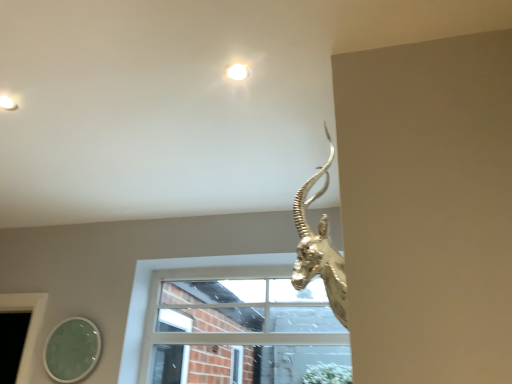
Question: From a real-world perspective, is green glass mirror at lower left positioned under gold metallic antelope head at upper right based on gravity?

Choices:
 (A) no
 (B) yes

Answer: (B)

Question: From the image's perspective, does green glass mirror at lower left appear lower than gold metallic antelope head at upper right?

Choices:
 (A) yes
 (B) no

Answer: (A)

Question: Does green glass mirror at lower left appear on the right side of gold metallic antelope head at upper right?

Choices:
 (A) yes
 (B) no

Answer: (B)

Question: Can gold metallic antelope head at upper right be found inside green glass mirror at lower left?

Choices:
 (A) yes
 (B) no

Answer: (B)

Question: Considering the relative sizes of green glass mirror at lower left and gold metallic antelope head at upper right in the image provided, is green glass mirror at lower left taller than gold metallic antelope head at upper right?

Choices:
 (A) no
 (B) yes

Answer: (A)

Question: Is green glass mirror at lower left outside gold metallic antelope head at upper right?

Choices:
 (A) no
 (B) yes

Answer: (B)

Question: Considering the relative sizes of green glass mirror at lower left and white glass window at center in the image provided, is green glass mirror at lower left wider than white glass window at center?

Choices:
 (A) yes
 (B) no

Answer: (B)

Question: Is green glass mirror at lower left with white glass window at center?

Choices:
 (A) yes
 (B) no

Answer: (B)

Question: Can you confirm if green glass mirror at lower left is thinner than white glass window at center?

Choices:
 (A) no
 (B) yes

Answer: (B)

Question: From a real-world perspective, is green glass mirror at lower left physically below white glass window at center?

Choices:
 (A) no
 (B) yes

Answer: (B)

Question: Is green glass mirror at lower left taller than white glass window at center?

Choices:
 (A) yes
 (B) no

Answer: (B)

Question: Can you confirm if green glass mirror at lower left is smaller than white glass window at center?

Choices:
 (A) no
 (B) yes

Answer: (B)

Question: Considering the relative positions of white glass window at center and green glass mirror at lower left in the image provided, is white glass window at center behind green glass mirror at lower left?

Choices:
 (A) no
 (B) yes

Answer: (A)